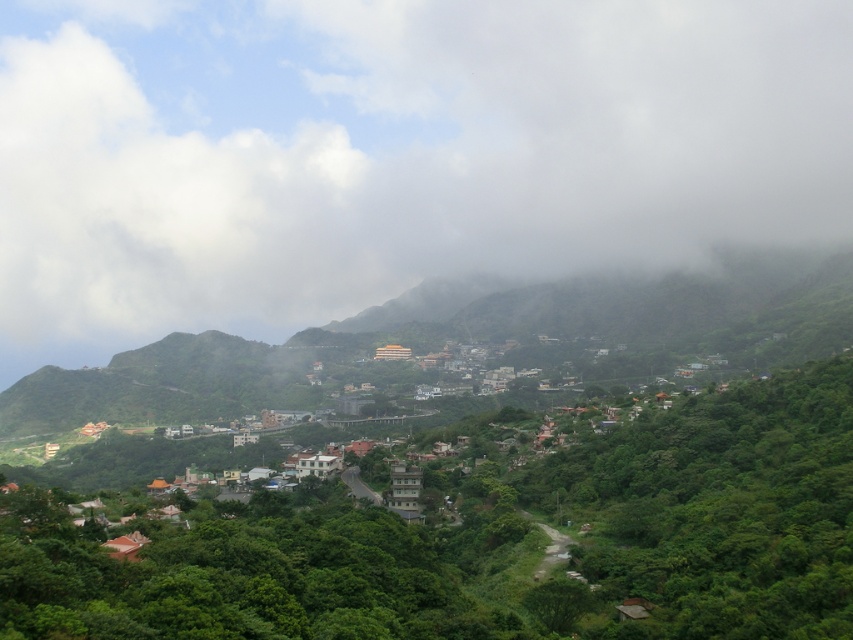
Is white fluffy cloud at upper center positioned behind white stucco houses at center?

Yes.

Does white fluffy cloud at upper center appear on the right side of white stucco houses at center?

Yes, white fluffy cloud at upper center is to the right of white stucco houses at center.

Identify the location of white fluffy cloud at upper center. This screenshot has width=853, height=640. (393, 154).